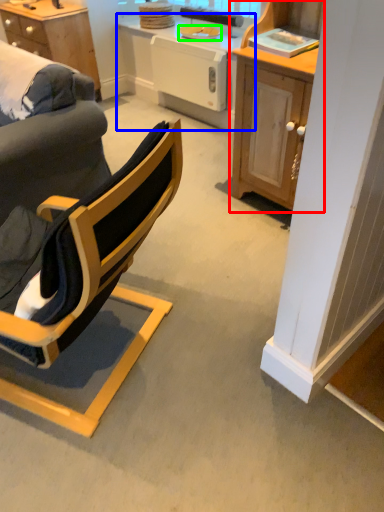
Question: Which object is positioned closest to cabinetry (highlighted by a red box)? Select from table (highlighted by a blue box) and plate (highlighted by a green box).

Choices:
 (A) table
 (B) plate

Answer: (A)